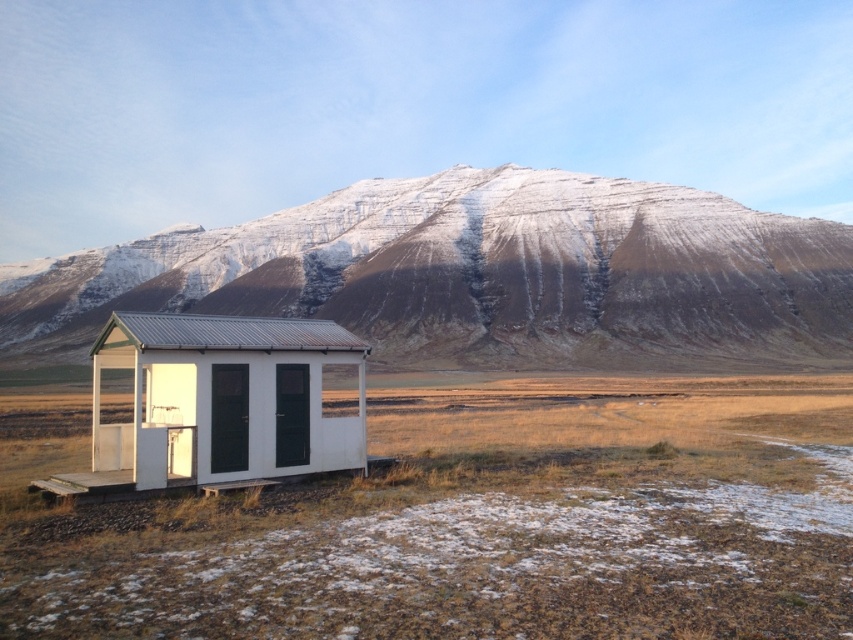
Question: Which of the following is the farthest from the observer?

Choices:
 (A) (463, 413)
 (B) (630, 193)

Answer: (B)

Question: Where is dry grass at lower left located in relation to white matte cabin at center in the image?

Choices:
 (A) above
 (B) below

Answer: (B)

Question: Among these objects, which one is farthest from the camera?

Choices:
 (A) white matte cabin at center
 (B) dry grass at lower left
 (C) snowy rock mountain at center

Answer: (C)

Question: Does dry grass at lower left appear over white matte cabin at center?

Choices:
 (A) no
 (B) yes

Answer: (A)

Question: Can you confirm if snowy rock mountain at center is smaller than white matte cabin at center?

Choices:
 (A) no
 (B) yes

Answer: (A)

Question: Which object is the farthest from the white matte cabin at center?

Choices:
 (A) dry grass at lower left
 (B) snowy rock mountain at center

Answer: (B)